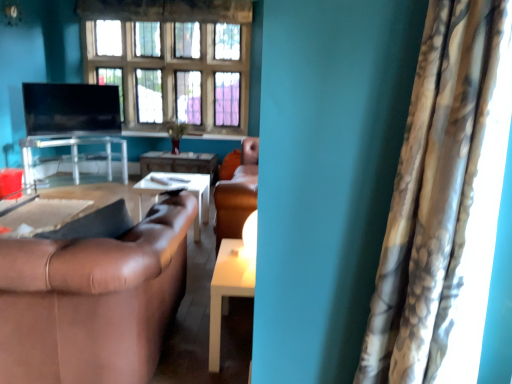
Find the location of a particular element. The height and width of the screenshot is (384, 512). free spot above white glossy table at center, arranged as the 3th table when viewed from the left (from a real-world perspective) is located at coordinates (242, 251).